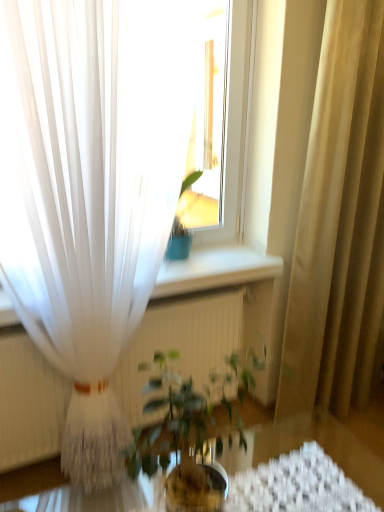
This screenshot has height=512, width=384. What do you see at coordinates (328, 444) in the screenshot?
I see `transparent glass table at center` at bounding box center [328, 444].

The height and width of the screenshot is (512, 384). I want to click on beige fabric curtain at right, the second curtain viewed from the left, so click(x=339, y=222).

From the image's perspective, would you say white sheer curtain at left, which is the second curtain from right to left, is positioned over beige fabric curtain at right, which is the 1th curtain in right-to-left order?

No, from the image's perspective, white sheer curtain at left, which is the second curtain from right to left, is not above beige fabric curtain at right, which is the 1th curtain in right-to-left order.

From a real-world perspective, relative to beige fabric curtain at right, which is the 1th curtain in right-to-left order, is white sheer curtain at left, which appears as the first curtain when viewed from the left, vertically above or below?

Clearly, from a real-world perspective, white sheer curtain at left, which appears as the first curtain when viewed from the left, is above beige fabric curtain at right, which is the 1th curtain in right-to-left order.

At what (x,y) coordinates should I click in order to perform the action: click on curtain that is on the right side of white sheer curtain at left, which appears as the first curtain when viewed from the left. Please return your answer as a coordinate pair (x, y). Looking at the image, I should click on (339, 222).

Choose the correct answer: Is white sheer curtain at left, which appears as the first curtain when viewed from the left, inside beige fabric curtain at right, the second curtain viewed from the left, or outside it?

white sheer curtain at left, which appears as the first curtain when viewed from the left, is spatially situated outside beige fabric curtain at right, the second curtain viewed from the left.

Would you say beige fabric curtain at right, which is the 1th curtain in right-to-left order, is part of green leafy plant at center's contents?

That's incorrect, beige fabric curtain at right, which is the 1th curtain in right-to-left order, is not inside green leafy plant at center.

Measure the distance from green leafy plant at center to beige fabric curtain at right, the second curtain viewed from the left.

green leafy plant at center is 32.54 inches from beige fabric curtain at right, the second curtain viewed from the left.

Which is more to the left, green leafy plant at center or beige fabric curtain at right, which is the 1th curtain in right-to-left order?

Positioned to the left is green leafy plant at center.

Relative to beige fabric curtain at right, the second curtain viewed from the left, is green leafy plant at center in front or behind?

Clearly, green leafy plant at center is in front of beige fabric curtain at right, the second curtain viewed from the left.

In the image, there is a transparent glass table at center. Where is `houseplant above it (from the image's perspective)`? houseplant above it (from the image's perspective) is located at coordinates (178, 442).

Is green leafy plant at center positioned behind transparent glass table at center?

Yes, it is.

Is green leafy plant at center next to transparent glass table at center and touching it?

No, green leafy plant at center is not in contact with transparent glass table at center.

From a real-world perspective, who is located lower, transparent glass table at center or white sheer curtain at left, which is the second curtain from right to left?

transparent glass table at center is physically lower.

Is transparent glass table at center turned away from white sheer curtain at left, which appears as the first curtain when viewed from the left?

Yes, transparent glass table at center's orientation is away from white sheer curtain at left, which appears as the first curtain when viewed from the left.

Starting from the transparent glass table at center, which curtain is the 1st one behind? Please provide its 2D coordinates.

[(90, 189)]

Can you confirm if transparent glass table at center is bigger than white sheer curtain at left, which appears as the first curtain when viewed from the left?

Actually, transparent glass table at center might be smaller than white sheer curtain at left, which appears as the first curtain when viewed from the left.

Considering the points (310, 174) and (53, 331), which point is in front, point (310, 174) or point (53, 331)?

Point (53, 331)

What's the angular difference between beige fabric curtain at right, which is the 1th curtain in right-to-left order, and white sheer curtain at left, which appears as the first curtain when viewed from the left,'s facing directions?

3.71 degrees separate the facing orientations of beige fabric curtain at right, which is the 1th curtain in right-to-left order, and white sheer curtain at left, which appears as the first curtain when viewed from the left.

Considering the positions of objects beige fabric curtain at right, which is the 1th curtain in right-to-left order, and white sheer curtain at left, which is the second curtain from right to left, in the image provided, who is in front, beige fabric curtain at right, which is the 1th curtain in right-to-left order, or white sheer curtain at left, which is the second curtain from right to left,?

white sheer curtain at left, which is the second curtain from right to left, is in front.

Is beige fabric curtain at right, which is the 1th curtain in right-to-left order, inside or outside of white sheer curtain at left, which is the second curtain from right to left?

beige fabric curtain at right, which is the 1th curtain in right-to-left order, is not inside white sheer curtain at left, which is the second curtain from right to left, it's outside.

Is beige fabric curtain at right, which is the 1th curtain in right-to-left order, at the left side of green leafy plant at center?

In fact, beige fabric curtain at right, which is the 1th curtain in right-to-left order, is to the right of green leafy plant at center.

Which is in front, beige fabric curtain at right, the second curtain viewed from the left, or green leafy plant at center?

green leafy plant at center is more forward.

Considering the sizes of objects beige fabric curtain at right, which is the 1th curtain in right-to-left order, and green leafy plant at center in the image provided, who is taller, beige fabric curtain at right, which is the 1th curtain in right-to-left order, or green leafy plant at center?

With more height is beige fabric curtain at right, which is the 1th curtain in right-to-left order.

Is beige fabric curtain at right, the second curtain viewed from the left, facing away from green leafy plant at center?

No, green leafy plant at center is not at the back of beige fabric curtain at right, the second curtain viewed from the left.

Who is bigger, white sheer curtain at left, which is the second curtain from right to left, or transparent glass table at center?

white sheer curtain at left, which is the second curtain from right to left.

Can you confirm if white sheer curtain at left, which appears as the first curtain when viewed from the left, is wider than transparent glass table at center?

In fact, white sheer curtain at left, which appears as the first curtain when viewed from the left, might be narrower than transparent glass table at center.

Is point (110, 283) positioned behind point (29, 485)?

That is False.

From a real-world perspective, does white sheer curtain at left, which appears as the first curtain when viewed from the left, stand above transparent glass table at center?

Yes.

I want to click on curtain that is in front of the beige fabric curtain at right, which is the 1th curtain in right-to-left order, so click(x=90, y=189).

Identify the location of the 1st curtain directly above the green leafy plant at center (from a real-world perspective). The width and height of the screenshot is (384, 512). (339, 222).

When comparing their distances from white sheer curtain at left, which is the second curtain from right to left, does transparent glass table at center or beige fabric curtain at right, the second curtain viewed from the left, seem further?

transparent glass table at center lies further to white sheer curtain at left, which is the second curtain from right to left, than the other object.

Based on their spatial positions, is transparent glass table at center or white sheer curtain at left, which is the second curtain from right to left, closer to green leafy plant at center?

white sheer curtain at left, which is the second curtain from right to left, is closer to green leafy plant at center.

Estimate the real-world distances between objects in this image. Which object is closer to beige fabric curtain at right, the second curtain viewed from the left, transparent glass table at center or green leafy plant at center?

Based on the image, transparent glass table at center appears to be nearer to beige fabric curtain at right, the second curtain viewed from the left.

Which object lies further to the anchor point beige fabric curtain at right, the second curtain viewed from the left, transparent glass table at center or white sheer curtain at left, which appears as the first curtain when viewed from the left?

Among the two, white sheer curtain at left, which appears as the first curtain when viewed from the left, is located further to beige fabric curtain at right, the second curtain viewed from the left.

Considering their positions, is white sheer curtain at left, which appears as the first curtain when viewed from the left, positioned closer to green leafy plant at center than transparent glass table at center?

white sheer curtain at left, which appears as the first curtain when viewed from the left, is positioned closer to the anchor green leafy plant at center.

Based on their spatial positions, is green leafy plant at center or transparent glass table at center closer to beige fabric curtain at right, the second curtain viewed from the left?

Based on the image, transparent glass table at center appears to be nearer to beige fabric curtain at right, the second curtain viewed from the left.

In the scene shown: Which object lies nearer to the anchor point beige fabric curtain at right, the second curtain viewed from the left, green leafy plant at center or white sheer curtain at left, which is the second curtain from right to left?

The object closer to beige fabric curtain at right, the second curtain viewed from the left, is green leafy plant at center.

Which object lies further to the anchor point white sheer curtain at left, which appears as the first curtain when viewed from the left, beige fabric curtain at right, which is the 1th curtain in right-to-left order, or green leafy plant at center?

beige fabric curtain at right, which is the 1th curtain in right-to-left order, is further to white sheer curtain at left, which appears as the first curtain when viewed from the left.

Locate an element on the screen. curtain between beige fabric curtain at right, the second curtain viewed from the left, and transparent glass table at center from top to bottom is located at coordinates (90, 189).

What are the coordinates of `houseplant located between white sheer curtain at left, which is the second curtain from right to left, and beige fabric curtain at right, the second curtain viewed from the left, in the left-right direction` in the screenshot? It's located at (178, 442).

Find the location of a particular element. houseplant between white sheer curtain at left, which is the second curtain from right to left, and transparent glass table at center from top to bottom is located at coordinates (178, 442).

You are a GUI agent. You are given a task and a screenshot of the screen. Output one action in this format:
    pyautogui.click(x=<x>, y=<y>)
    Task: Click on the houseplant between beige fabric curtain at right, which is the 1th curtain in right-to-left order, and transparent glass table at center, in the vertical direction
    This screenshot has height=512, width=384.
    Given the screenshot: What is the action you would take?
    pyautogui.click(x=178, y=442)